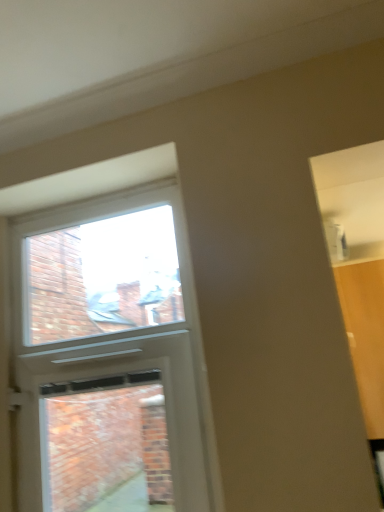
Question: Does clear glass window at upper center have a smaller size compared to white plastic screen door at upper left?

Choices:
 (A) yes
 (B) no

Answer: (A)

Question: Are clear glass window at upper center and white plastic screen door at upper left far apart?

Choices:
 (A) yes
 (B) no

Answer: (B)

Question: From the image's perspective, is clear glass window at upper center on white plastic screen door at upper left?

Choices:
 (A) yes
 (B) no

Answer: (A)

Question: Does clear glass window at upper center turn towards white plastic screen door at upper left?

Choices:
 (A) yes
 (B) no

Answer: (B)

Question: Could white plastic screen door at upper left be considered to be inside clear glass window at upper center?

Choices:
 (A) yes
 (B) no

Answer: (B)

Question: From a real-world perspective, is clear glass window at upper center positioned over white plastic screen door at upper left based on gravity?

Choices:
 (A) yes
 (B) no

Answer: (A)

Question: Is white plastic screen door at upper left to the left of clear glass window at upper center from the viewer's perspective?

Choices:
 (A) no
 (B) yes

Answer: (A)

Question: Considering the relative sizes of white plastic screen door at upper left and clear glass window at upper center in the image provided, is white plastic screen door at upper left shorter than clear glass window at upper center?

Choices:
 (A) no
 (B) yes

Answer: (A)

Question: Can you confirm if white plastic screen door at upper left is smaller than clear glass window at upper center?

Choices:
 (A) yes
 (B) no

Answer: (B)

Question: Does white plastic screen door at upper left have a larger size compared to clear glass window at upper center?

Choices:
 (A) no
 (B) yes

Answer: (B)

Question: Is white plastic screen door at upper left behind clear glass window at upper center?

Choices:
 (A) yes
 (B) no

Answer: (B)

Question: Does white plastic screen door at upper left appear on the right side of clear glass window at upper center?

Choices:
 (A) no
 (B) yes

Answer: (B)

Question: From the image's perspective, is clear glass window at upper center located above or below white plastic screen door at upper left?

Choices:
 (A) below
 (B) above

Answer: (B)